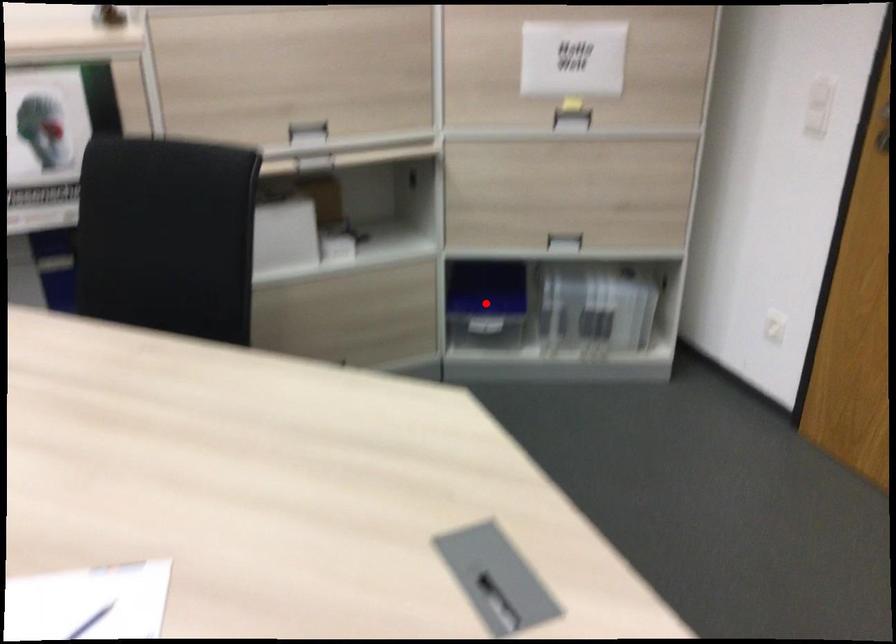
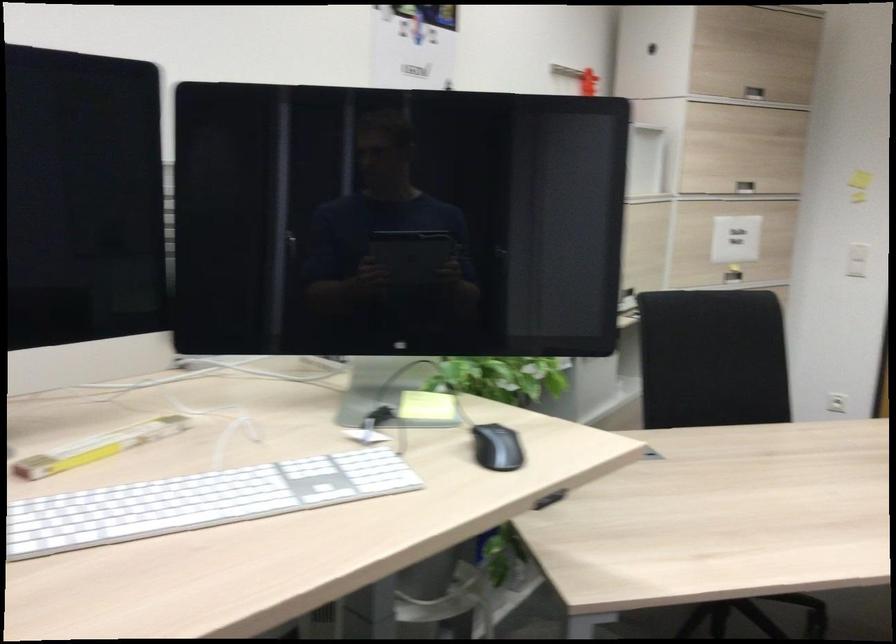
Question: I am providing you with two images of the same scene from different viewpoints. A red point is marked on the first image. Is the red point's position out of view in image 2?

Choices:
 (A) Yes
 (B) No

Answer: (A)